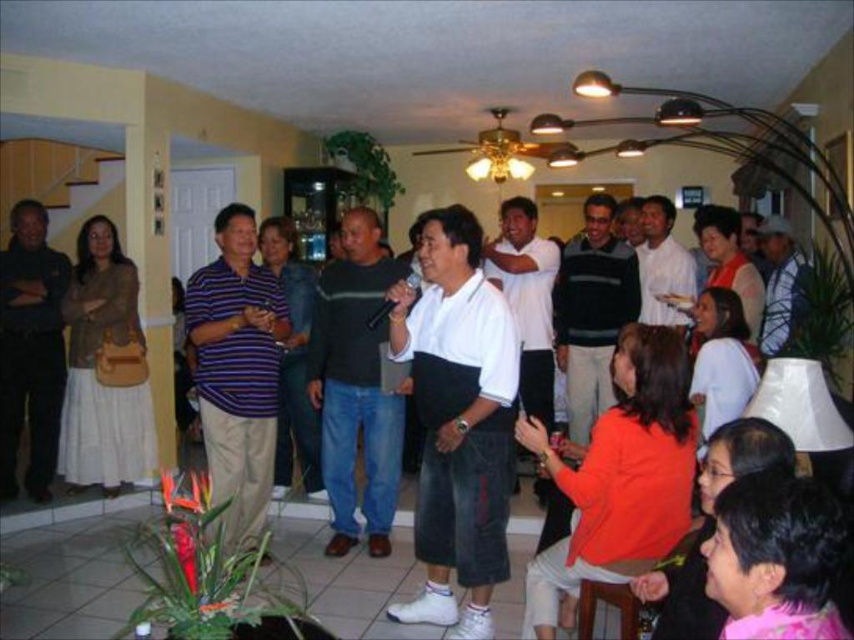
The height and width of the screenshot is (640, 854). What do you see at coordinates (458, 420) in the screenshot?
I see `white matte shirt at center` at bounding box center [458, 420].

Who is lower down, white matte shirt at center or white cotton shirt at center?

Positioned lower is white cotton shirt at center.

What do you see at coordinates (458, 420) in the screenshot? The image size is (854, 640). I see `white matte shirt at center` at bounding box center [458, 420].

This screenshot has width=854, height=640. Find the location of `white matte shirt at center`. white matte shirt at center is located at coordinates (458, 420).

Between white matte shirt at center and dark brown leather jacket at left, which one has less height?

white matte shirt at center is shorter.

Who is positioned more to the left, white matte shirt at center or dark brown leather jacket at left?

Positioned to the left is dark brown leather jacket at left.

Where is `white matte shirt at center`? white matte shirt at center is located at coordinates (458, 420).

Where is `white matte shirt at center`? The width and height of the screenshot is (854, 640). white matte shirt at center is located at coordinates (458, 420).

Between white cotton shirt at center and dark brown leather jacket at left, which one is positioned higher?

dark brown leather jacket at left is above.

Is point (309, 541) in front of point (34, 401)?

Yes, point (309, 541) is in front of point (34, 401).

Is point (332, 614) farther from viewer compared to point (50, 292)?

No, it is not.

At what (x,y) coordinates should I click in order to perform the action: click on white cotton shirt at center. Please return your answer as a coordinate pair (x, y). Image resolution: width=854 pixels, height=640 pixels. Looking at the image, I should click on (69, 577).